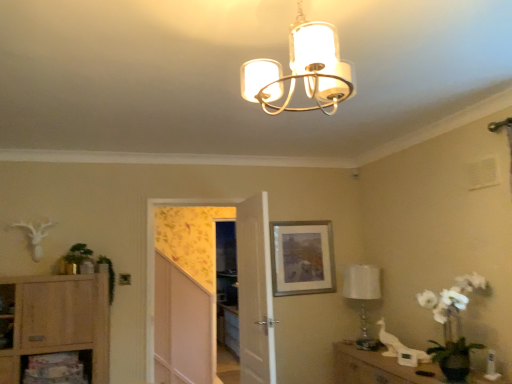
Question: Is light wood cabinet at lower left placed right next to green leafy plant at left, the second plant from the right?

Choices:
 (A) no
 (B) yes

Answer: (A)

Question: Is light wood cabinet at lower left completely or partially outside of green leafy plant at left, the second plant from the right?

Choices:
 (A) yes
 (B) no

Answer: (A)

Question: Is light wood cabinet at lower left oriented towards green leafy plant at left, which appears as the 1th plant when viewed from the left?

Choices:
 (A) no
 (B) yes

Answer: (A)

Question: Is light wood cabinet at lower left wider than green leafy plant at left, which appears as the 1th plant when viewed from the left?

Choices:
 (A) no
 (B) yes

Answer: (B)

Question: From a real-world perspective, is light wood cabinet at lower left physically above green leafy plant at left, the second plant from the right?

Choices:
 (A) no
 (B) yes

Answer: (A)

Question: Would you say green leafy plant at left, which appears as the 1th plant when viewed from the left, is to the left or to the right of light wood cabinet at lower left in the picture?

Choices:
 (A) right
 (B) left

Answer: (A)

Question: Relative to light wood cabinet at lower left, is green leafy plant at left, which appears as the 1th plant when viewed from the left, in front or behind?

Choices:
 (A) front
 (B) behind

Answer: (B)

Question: From a real-world perspective, relative to light wood cabinet at lower left, is green leafy plant at left, the second plant from the right, vertically above or below?

Choices:
 (A) above
 (B) below

Answer: (A)

Question: From the image's perspective, relative to light wood cabinet at lower left, is green leafy plant at left, which appears as the 1th plant when viewed from the left, above or below?

Choices:
 (A) above
 (B) below

Answer: (A)

Question: Is point (371, 289) closer or farther from the camera than point (327, 261)?

Choices:
 (A) farther
 (B) closer

Answer: (B)

Question: From the image's perspective, is white glass lamp at right, which appears as the second lamp when viewed from the top, located above or below silver/metallic picture frame at center?

Choices:
 (A) above
 (B) below

Answer: (B)

Question: Based on their sizes in the image, would you say white glass lamp at right, which is the 1th lamp from back to front, is bigger or smaller than silver/metallic picture frame at center?

Choices:
 (A) big
 (B) small

Answer: (A)

Question: Is white glass lamp at right, the 1th lamp when ordered from bottom to top, situated inside silver/metallic picture frame at center or outside?

Choices:
 (A) inside
 (B) outside

Answer: (B)

Question: From a real-world perspective, relative to green leafy plant at left, which appears as the 1th plant when viewed from the left, is white matte chandelier at upper center, which is the 1th lamp from front to back, vertically above or below?

Choices:
 (A) below
 (B) above

Answer: (B)

Question: Considering the positions of white matte chandelier at upper center, which is the 1th lamp from front to back, and green leafy plant at left, which appears as the 1th plant when viewed from the left, in the image, is white matte chandelier at upper center, which is the 1th lamp from front to back, wider or thinner than green leafy plant at left, which appears as the 1th plant when viewed from the left,?

Choices:
 (A) thin
 (B) wide

Answer: (B)